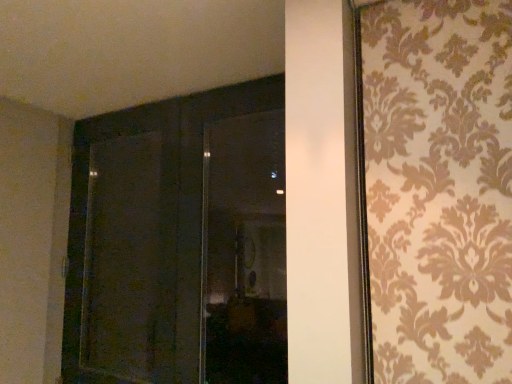
Question: In terms of size, does transparent glass window at center appear bigger or smaller than matte dark wood screen door at left?

Choices:
 (A) big
 (B) small

Answer: (B)

Question: From the image's perspective, is transparent glass window at center positioned above or below matte dark wood screen door at left?

Choices:
 (A) above
 (B) below

Answer: (A)

Question: Considering the real-world distances, which object is farthest from the transparent glass window at center?

Choices:
 (A) matte dark wood screen door at left
 (B) dark wood door at center

Answer: (A)

Question: Considering the real-world distances, which object is farthest from the transparent glass window at center?

Choices:
 (A) matte dark wood screen door at left
 (B) dark wood door at center

Answer: (A)